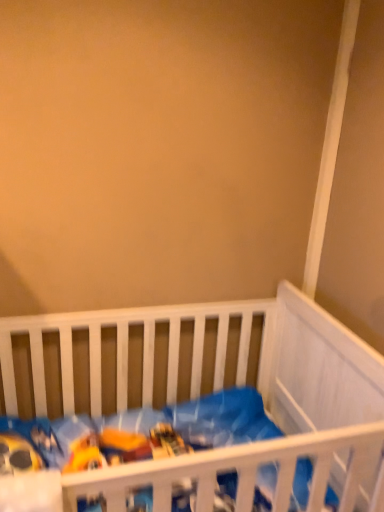
The image size is (384, 512). What do you see at coordinates (206, 420) in the screenshot? I see `blue fabric at center` at bounding box center [206, 420].

What is the approximate height of blue fabric at center?

It is 6.37 inches.

Measure the distance between point (64, 460) and camera.

Point (64, 460) is 1.45 meters from camera.

At what (x,y) coordinates should I click in order to perform the action: click on blue fabric at center. Please return your answer as a coordinate pair (x, y). This screenshot has height=512, width=384. Looking at the image, I should click on (206, 420).

Locate an element on the screen. The width and height of the screenshot is (384, 512). blue fabric at center is located at coordinates (206, 420).